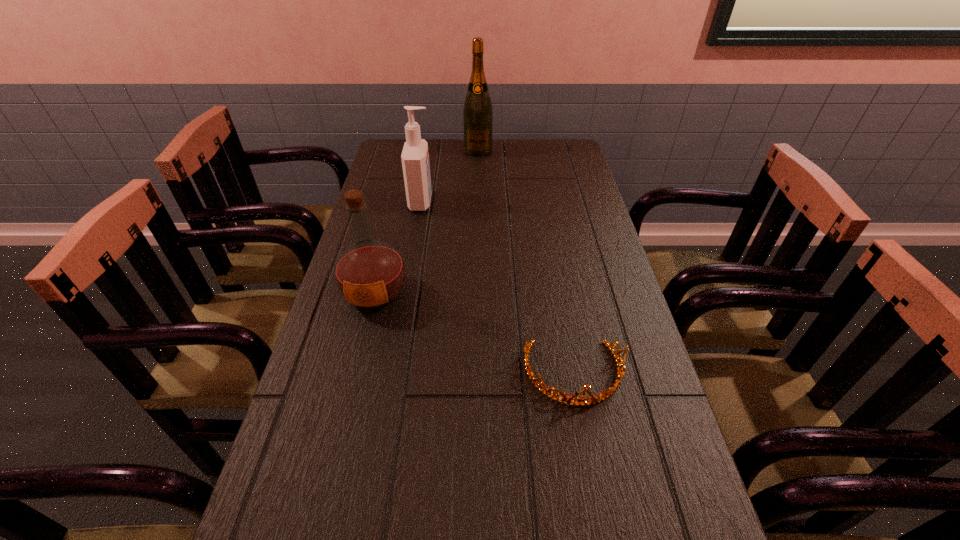
Find the location of a particular element. The width and height of the screenshot is (960, 540). free spot between the third nearest object and the second nearest object is located at coordinates (398, 248).

You are a GUI agent. You are given a task and a screenshot of the screen. Output one action in this format:
    pyautogui.click(x=<x>, y=<y>)
    Task: Click on the vacant area that lies between the second nearest object and the tiara
    
    Given the screenshot: What is the action you would take?
    pyautogui.click(x=474, y=334)

Where is `object that is the second closest to the farthest object`? This screenshot has width=960, height=540. object that is the second closest to the farthest object is located at coordinates (370, 274).

Locate an element on the screen. The height and width of the screenshot is (540, 960). the third closest object relative to the nearest object is located at coordinates (477, 113).

At what (x,y) coordinates should I click in order to perform the action: click on free point that satisfies the following two spatial constraints: 1. on the front-facing side of the tallest object; 2. on the front label of the second farthest object. Please return your answer as a coordinate pair (x, y). This screenshot has height=540, width=960. Looking at the image, I should click on (478, 202).